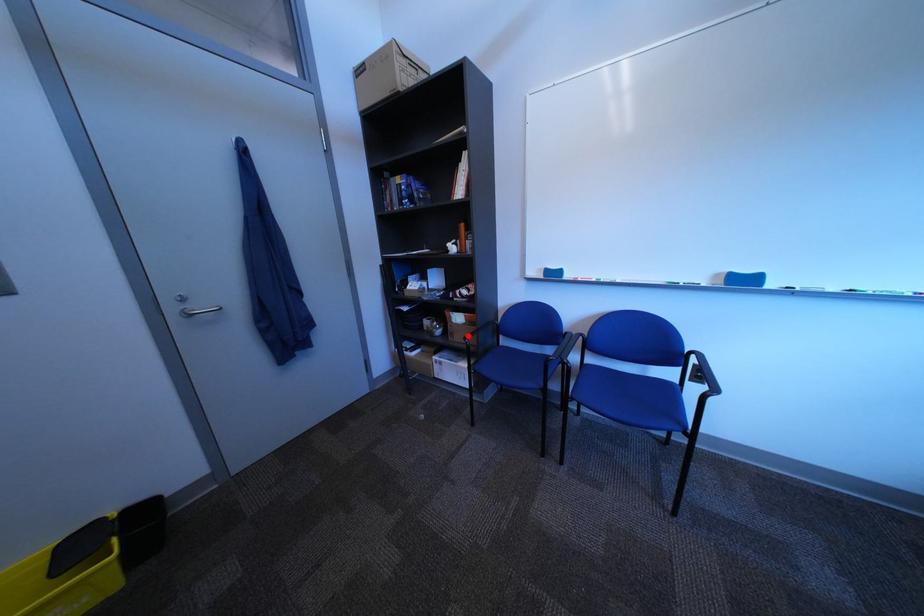
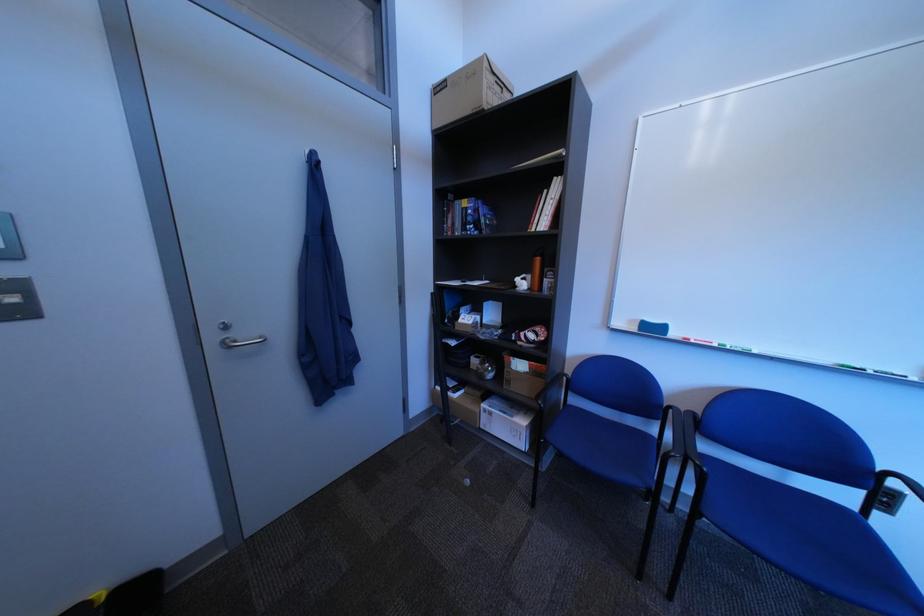
In the second image, find the point that corresponds to the highlighted location in the first image.

(525, 383)